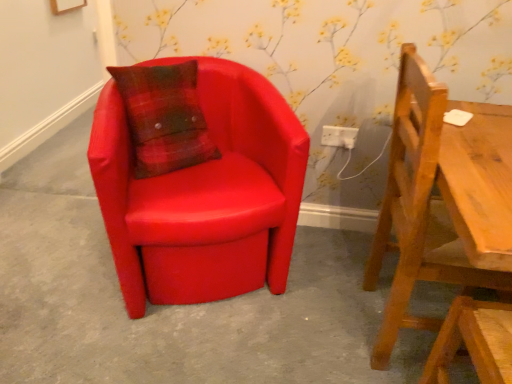
Question: Which is correct: wooden chair at right, the second chair from the left, is inside white plastic electric outlet at center, or outside of it?

Choices:
 (A) outside
 (B) inside

Answer: (A)

Question: From a real-world perspective, is wooden chair at right, the second chair from the left, physically located above or below white plastic electric outlet at center?

Choices:
 (A) below
 (B) above

Answer: (B)

Question: Which object is the closest to the white plastic electric outlet at center?

Choices:
 (A) wooden chair at right, the second chair from the left
 (B) matte red chair at center
 (C) matte leather chair at left, the second chair viewed from the right

Answer: (C)

Question: Which of these objects is positioned closest to the matte red chair at center?

Choices:
 (A) wooden chair at right, the second chair from the left
 (B) white plastic electric outlet at center
 (C) matte leather chair at left, acting as the 1th chair starting from the left

Answer: (C)